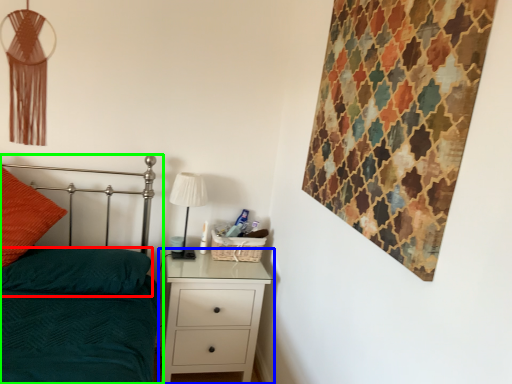
Question: Estimate the real-world distances between objects in this image. Which object is farther from pillow (highlighted by a red box), chest of drawers (highlighted by a blue box) or bed (highlighted by a green box)?

Choices:
 (A) chest of drawers
 (B) bed

Answer: (A)